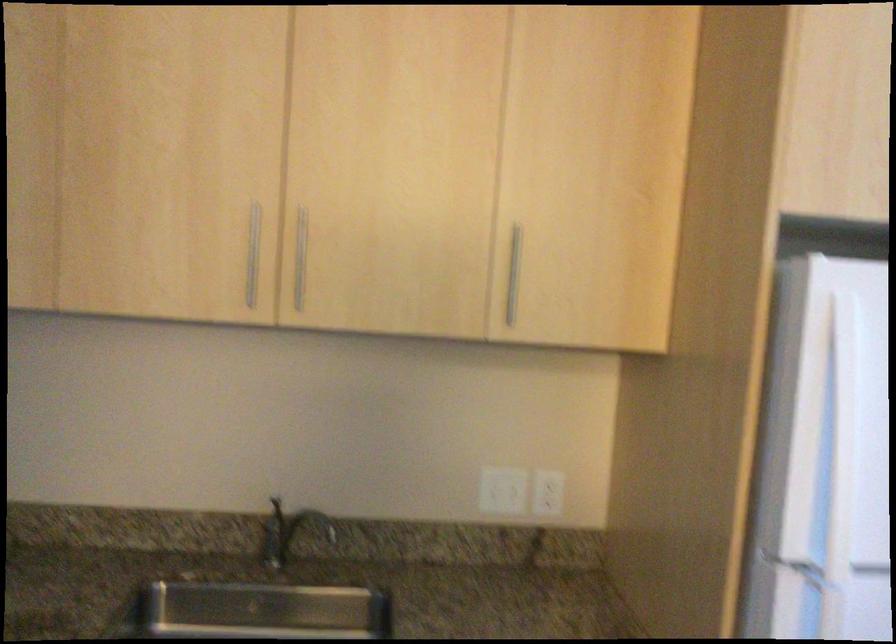
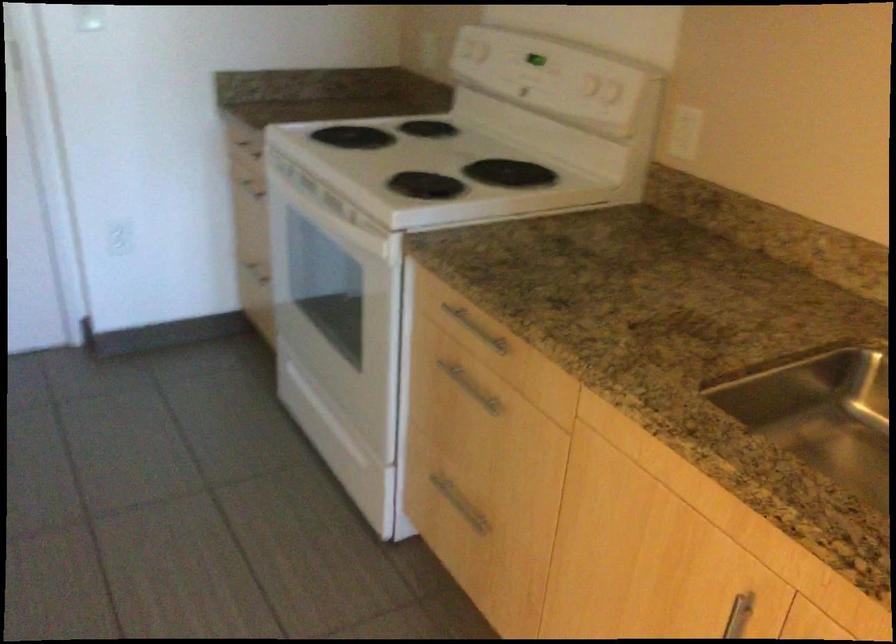
How did the camera likely rotate?

The camera's rotation is toward left-down.